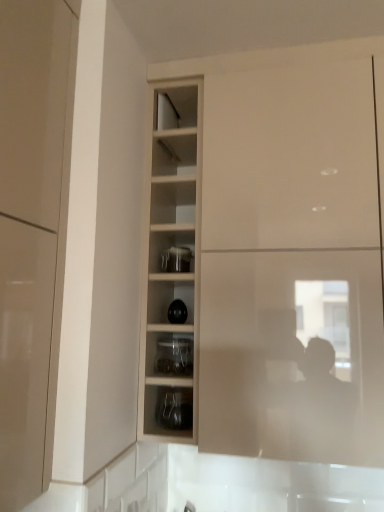
Question: Is clear glass jar at center, marked as the second shelf in a bottom-to-top arrangement, thinner than glossy beige cabinet at left, which is the first cabinetry in front-to-back order?

Choices:
 (A) yes
 (B) no

Answer: (B)

Question: Is clear glass jar at center, marked as the second shelf in a bottom-to-top arrangement, positioned with its back to glossy beige cabinet at left, positioned as the second cabinetry in right-to-left order?

Choices:
 (A) no
 (B) yes

Answer: (A)

Question: Does clear glass jar at center, placed as the first shelf when sorted from top to bottom, have a lesser height compared to glossy beige cabinet at left, which is the first cabinetry in front-to-back order?

Choices:
 (A) no
 (B) yes

Answer: (B)

Question: Considering the relative positions of clear glass jar at center, marked as the second shelf in a bottom-to-top arrangement, and glossy beige cabinet at left, which is the first cabinetry in front-to-back order, in the image provided, is clear glass jar at center, marked as the second shelf in a bottom-to-top arrangement, behind glossy beige cabinet at left, which is the first cabinetry in front-to-back order,?

Choices:
 (A) no
 (B) yes

Answer: (B)

Question: Is clear glass jar at center, placed as the first shelf when sorted from top to bottom, outside glossy beige cabinet at left, which is the first cabinetry in front-to-back order?

Choices:
 (A) yes
 (B) no

Answer: (A)

Question: Is point (190, 343) closer or farther from the camera than point (175, 264)?

Choices:
 (A) farther
 (B) closer

Answer: (B)

Question: In terms of size, does clear glass jar at center, marked as the second shelf in a bottom-to-top arrangement, appear bigger or smaller than transparent glass jar at center?

Choices:
 (A) big
 (B) small

Answer: (A)

Question: From the image's perspective, is clear glass jar at center, placed as the first shelf when sorted from top to bottom, positioned above or below transparent glass jar at center?

Choices:
 (A) below
 (B) above

Answer: (A)

Question: In terms of height, does clear glass jar at center, marked as the second shelf in a bottom-to-top arrangement, look taller or shorter compared to transparent glass jar at center?

Choices:
 (A) tall
 (B) short

Answer: (A)

Question: Is glossy beige cabinet at left, the 2th cabinetry in the back-to-front sequence, in front of or behind matte black jar at center, acting as the 1th shelf starting from the bottom, in the image?

Choices:
 (A) front
 (B) behind

Answer: (A)

Question: Choose the correct answer: Is glossy beige cabinet at left, the 2th cabinetry in the back-to-front sequence, inside matte black jar at center, the second shelf positioned from the top, or outside it?

Choices:
 (A) inside
 (B) outside

Answer: (B)

Question: Does point (44, 129) appear closer or farther from the camera than point (185, 400)?

Choices:
 (A) closer
 (B) farther

Answer: (A)

Question: Looking at the image, does glossy beige cabinet at left, acting as the 1th cabinetry starting from the left, seem bigger or smaller compared to matte black jar at center, the second shelf positioned from the top?

Choices:
 (A) big
 (B) small

Answer: (A)

Question: Does point (190, 288) appear closer or farther from the camera than point (160, 269)?

Choices:
 (A) farther
 (B) closer

Answer: (A)

Question: Is wooden shelves at center to the left or to the right of transparent glass jar at center in the image?

Choices:
 (A) left
 (B) right

Answer: (B)